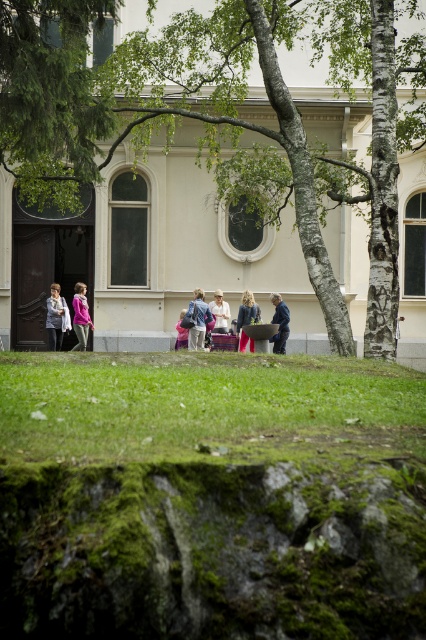
You are a photographer trying to capture a candid shot of the matte blue jacket at center without including the green mossy rock at lower center in the frame. Based on their sizes, is this possible?

The green mossy rock at lower center has a smaller size compared to matte blue jacket at center. Since the rock is smaller, it is possible to frame the shot so that the matte blue jacket at center is visible while excluding the smaller green mossy rock at lower center.

You are a photographer trying to capture a photo of the matte gray sweater at center without the green mossy rock at lower center blocking it. What should you do?

Move the camera backward to position the matte gray sweater at center in front of the green mossy rock at lower center, ensuring the sweater is closer to the camera than the rock.

You are standing in front of the building and want to take a photo that includes both point (192, 42) and point (175, 342). Since one is closer to you than the other, will you need to adjust your camera angle to ensure both points are in frame?

Yes, you need to adjust your camera angle because point (192, 42) is closer to the camera than point (175, 342), so they are at different depths. This may require angling the camera to capture both points within the frame.